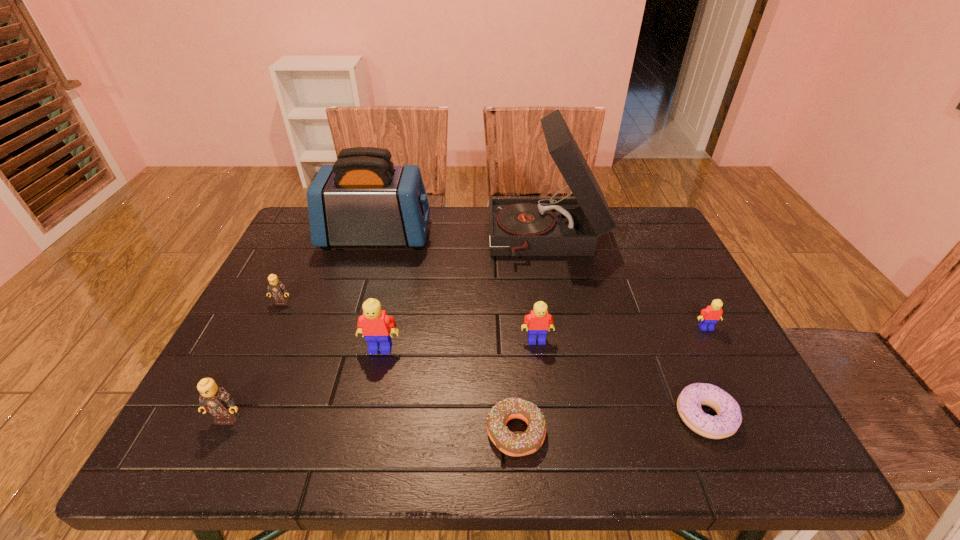
You are a GUI agent. You are given a task and a screenshot of the screen. Output one action in this format:
    pyautogui.click(x=<x>, y=<y>)
    Task: Click on the vacant point located 0.200m on the front-facing side of the biggest yellow Lego
    
    Given the screenshot: What is the action you would take?
    pyautogui.click(x=361, y=437)

At what (x,y) coordinates should I click in order to perform the action: click on free spot located 0.240m on the front-facing side of the second biggest yellow Lego. Please return your answer as a coordinate pair (x, y). Looking at the image, I should click on (549, 443).

I want to click on free space located 0.070m in front of the nearest Lego, so click(207, 460).

The height and width of the screenshot is (540, 960). What are the coordinates of `free space located 0.210m on the front-facing side of the rightmost yellow Lego` in the screenshot? It's located at (748, 409).

You are a GUI agent. You are given a task and a screenshot of the screen. Output one action in this format:
    pyautogui.click(x=<x>, y=<y>)
    Task: Click on the free space located 0.280m in front of the seventh nearest object
    
    Given the screenshot: What is the action you would take?
    pyautogui.click(x=234, y=402)

I want to click on free space located on the back of the right doughnut, so click(x=680, y=357).

The width and height of the screenshot is (960, 540). I want to click on vacant space situated on the back of the chocolate doughnut, so pyautogui.click(x=510, y=338).

The height and width of the screenshot is (540, 960). In order to click on phonograph_record that is positioned at the far edge in this screenshot , I will do `click(551, 226)`.

Identify the location of toaster located at the far edge. (363, 199).

You are a GUI agent. You are given a task and a screenshot of the screen. Output one action in this format:
    pyautogui.click(x=<x>, y=<y>)
    Task: Click on the Lego located at the near edge
    This screenshot has height=540, width=960.
    Given the screenshot: What is the action you would take?
    pyautogui.click(x=214, y=399)